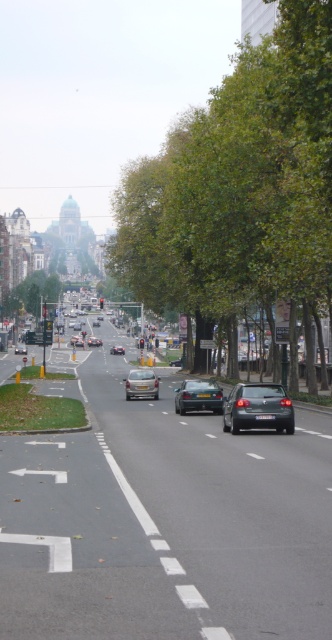
You are a pedestrian waiting at the crosswalk near the green leafy tree at left. You see the matte silver sedan at center approaching. Can you safely cross before it reaches your position?

The green leafy tree at left is in front of the matte silver sedan at center, meaning the sedan is behind the tree from your perspective. Since the sedan is behind the tree, it is farther away from you, so you can safely cross before it reaches your position.

You are standing at the pedestrian crossing sign on the left side of the street. Looking towards the green leafy tree at center, in which direction should you walk to reach the tree?

The green leafy tree at center is located at point 0.287 on the x axis and 0.723 on the y axis. Since you are at the pedestrian crossing sign on the left side of the street, you should walk towards the center of the street to reach the green leafy tree at center.

You are a delivery driver who needs to park your matte silver car at center near the green leafy tree at left. Given that the parking space is only 2 meters wide, can you park your car there?

The green leafy tree at left has a larger size compared to matte silver car at center. However, the size of the tree does not directly affect the width of the parking space. Since the parking space is 2 meters wide, and the car is smaller than the tree, it is possible to park the matte silver car at center there as long as the car fits within the 2 meters width.